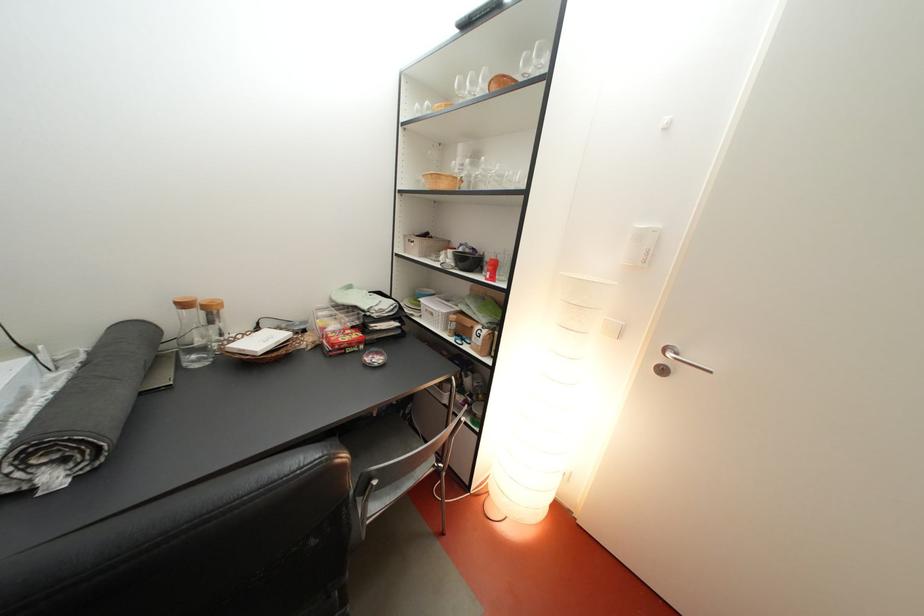
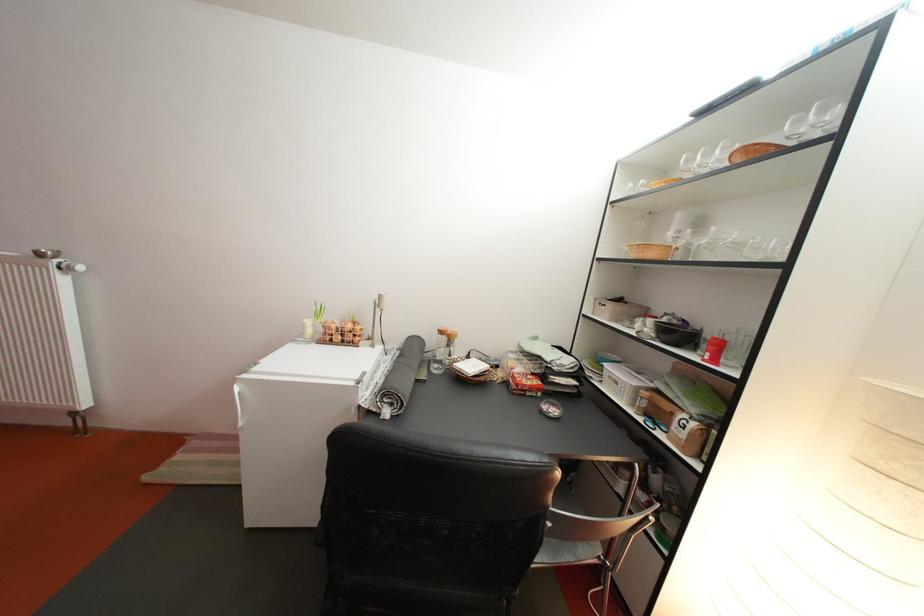
Locate, in the second image, the point that corresponds to point (465, 323) in the first image.

(658, 400)